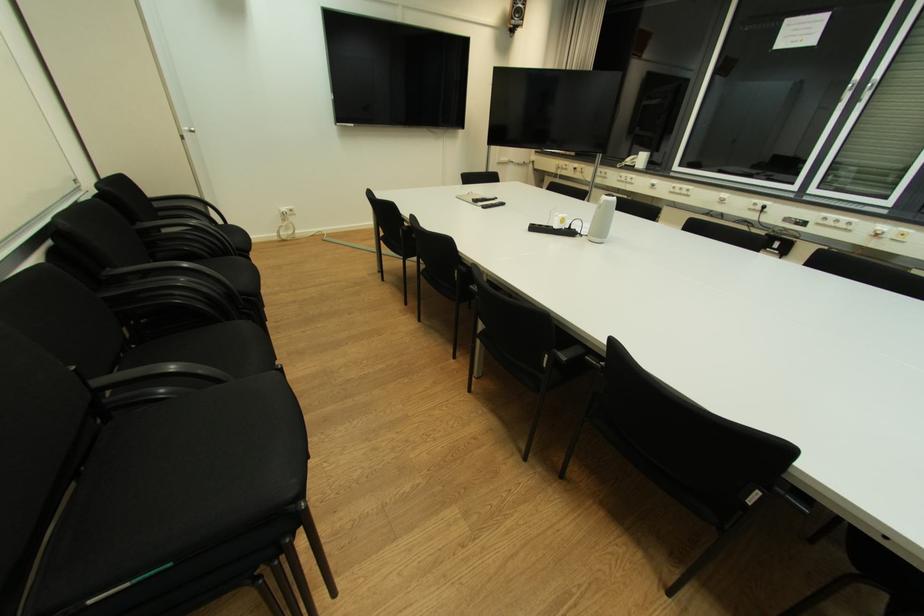
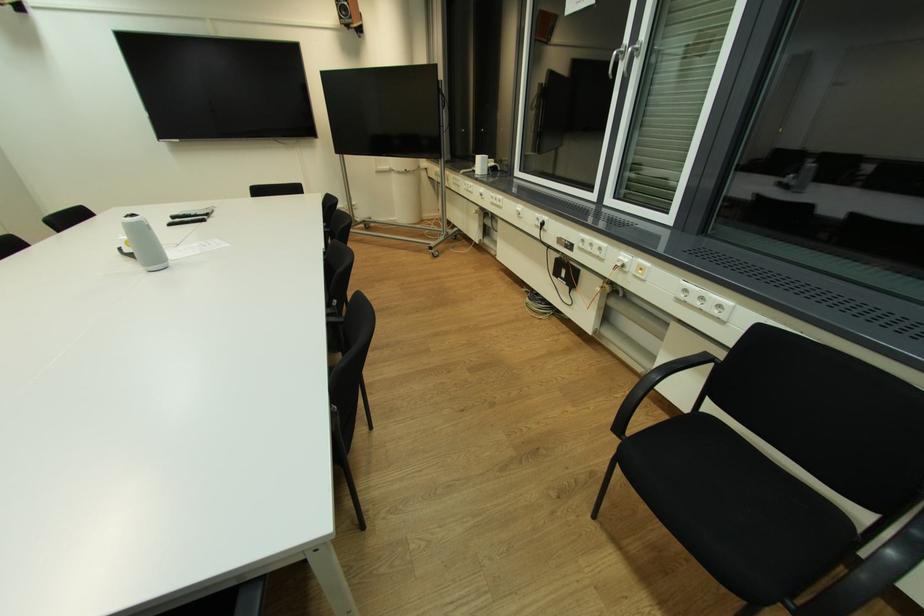
In the second image, find the point that corresponds to (855,86) in the first image.

(621, 54)